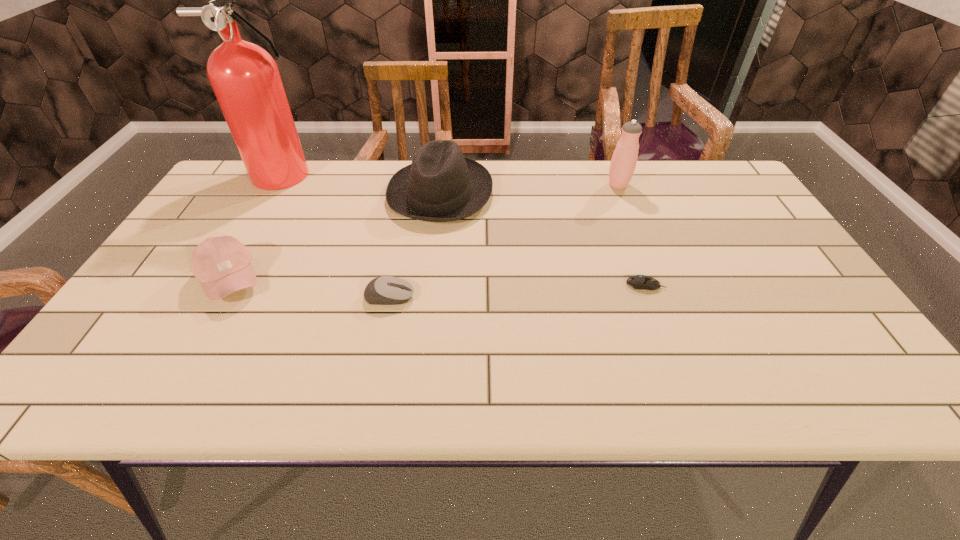
Identify the location of free space located on the left of the third tallest object. The image size is (960, 540). (331, 193).

I want to click on vacant point located 0.270m on the front-facing side of the baseball cap, so click(x=377, y=279).

Identify the location of free location located on the wheel side of the taller computer mouse. This screenshot has width=960, height=540. (496, 296).

At what (x,y) coordinates should I click in order to perform the action: click on free space located 0.140m on the right of the shortest object. Please return your answer as a coordinate pair (x, y). The width and height of the screenshot is (960, 540). Looking at the image, I should click on (724, 285).

Where is `fire extinguisher that is at the far edge`? The image size is (960, 540). fire extinguisher that is at the far edge is located at coordinates (245, 78).

Locate an element on the screen. The image size is (960, 540). thermos bottle present at the far edge is located at coordinates (623, 163).

You are a GUI agent. You are given a task and a screenshot of the screen. Output one action in this format:
    pyautogui.click(x=<x>, y=<y>)
    Task: Click on the fedora that is at the far edge
    The height and width of the screenshot is (540, 960).
    Given the screenshot: What is the action you would take?
    pyautogui.click(x=441, y=185)

Identify the location of fire extinguisher at the left edge. (245, 78).

Image resolution: width=960 pixels, height=540 pixels. I want to click on baseball cap located in the left edge section of the desktop, so click(222, 264).

Where is `object that is at the far left corner`? object that is at the far left corner is located at coordinates (245, 78).